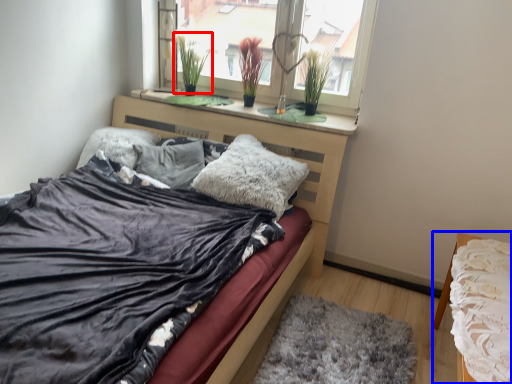
Question: Among these objects, which one is nearest to the camera, plant (highlighted by a red box) or nightstand (highlighted by a blue box)?

Choices:
 (A) plant
 (B) nightstand

Answer: (B)